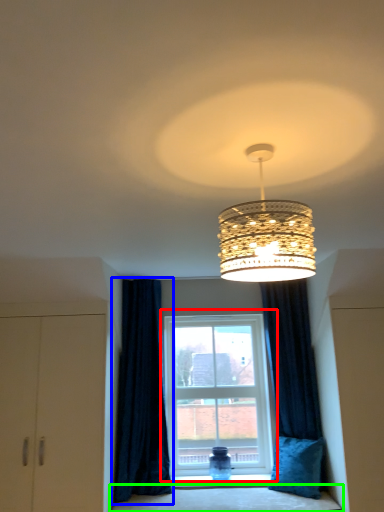
Question: Considering the real-world distances, which object is closest to window (highlighted by a red box)? curtain (highlighted by a blue box) or bedding (highlighted by a green box).

Choices:
 (A) curtain
 (B) bedding

Answer: (A)